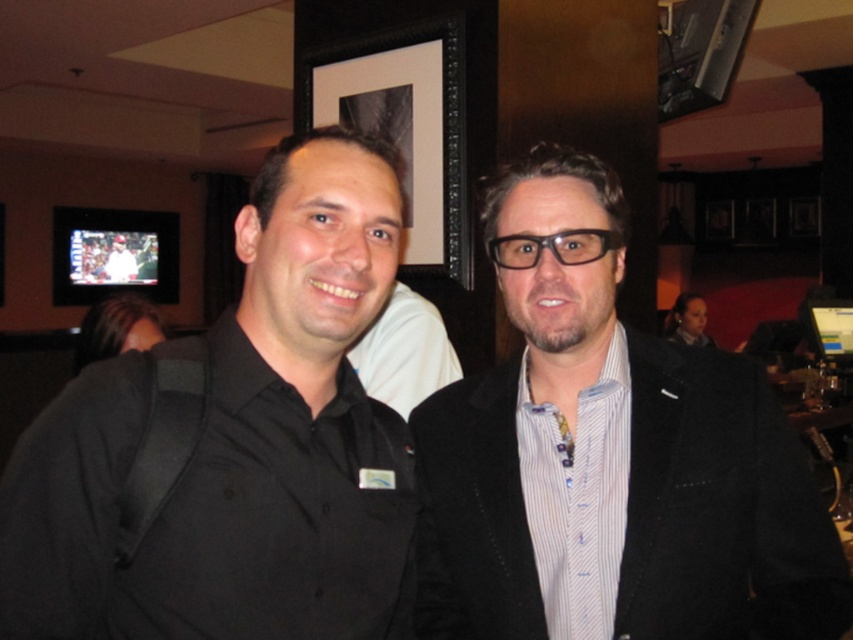
Is the position of matte black suit at center more distant than that of black matte shirt at left?

Yes, matte black suit at center is further from the viewer.

Between point (425, 486) and point (306, 272), which one is positioned behind?

Positioned behind is point (425, 486).

Between point (558, 445) and point (219, 364), which one is positioned in front?

Point (219, 364) is in front.

Where is `matte black suit at center`? Image resolution: width=853 pixels, height=640 pixels. matte black suit at center is located at coordinates (608, 458).